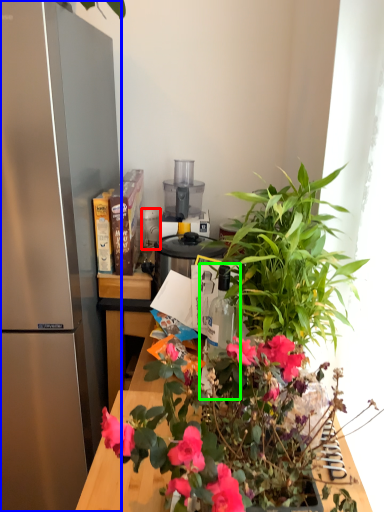
Question: Which object is the farthest from appliance (highlighted by a red box)? Choose among these: refrigerator (highlighted by a blue box) or bottle (highlighted by a green box).

Choices:
 (A) refrigerator
 (B) bottle

Answer: (B)